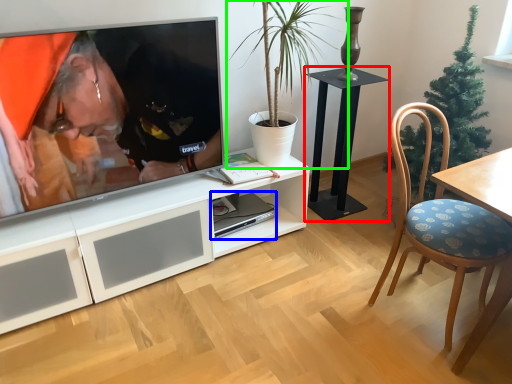
Question: Considering the real-world distances, which object is farthest from table (highlighted by a red box)? computer (highlighted by a blue box) or houseplant (highlighted by a green box)?

Choices:
 (A) computer
 (B) houseplant

Answer: (A)